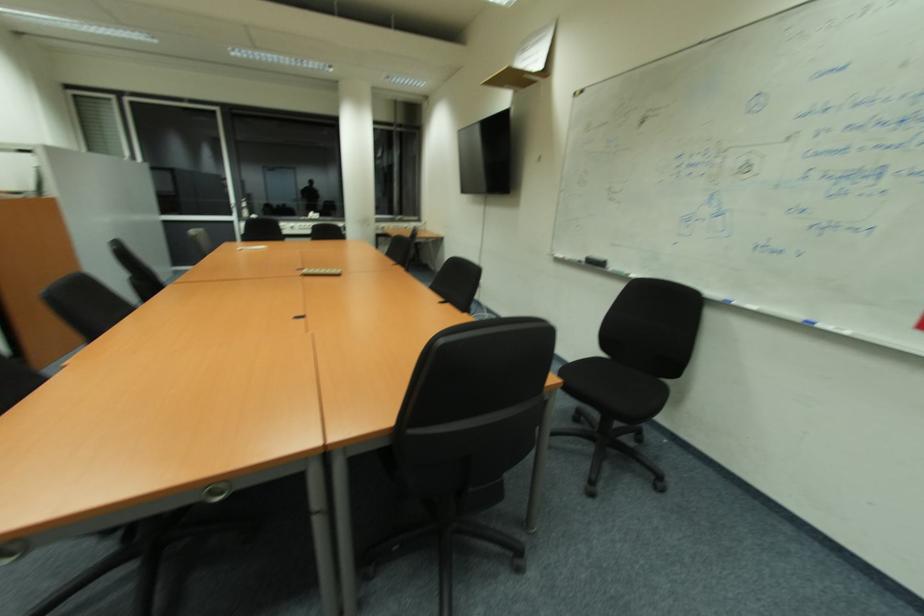
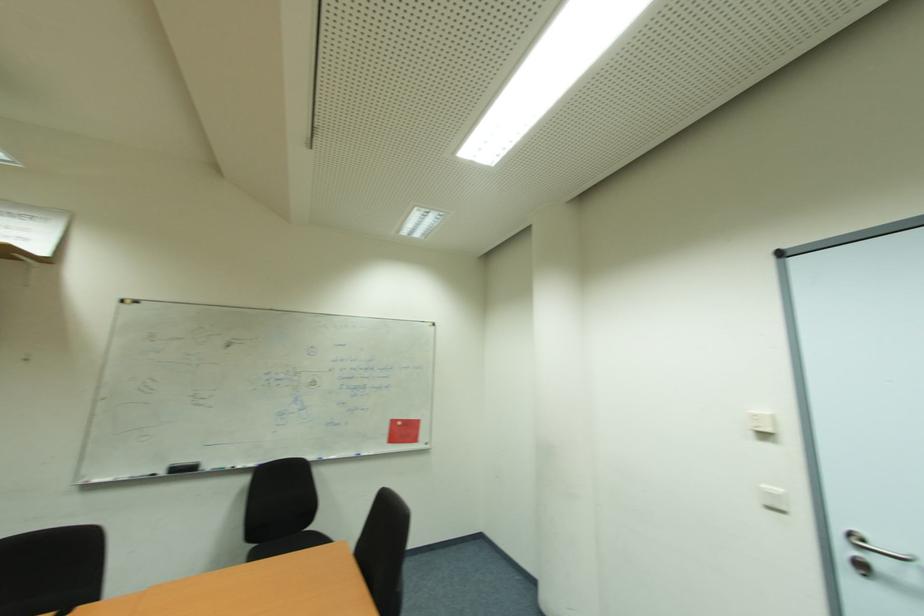
Find the pixel in the second image that matches point 601,265 in the first image.

(189, 469)